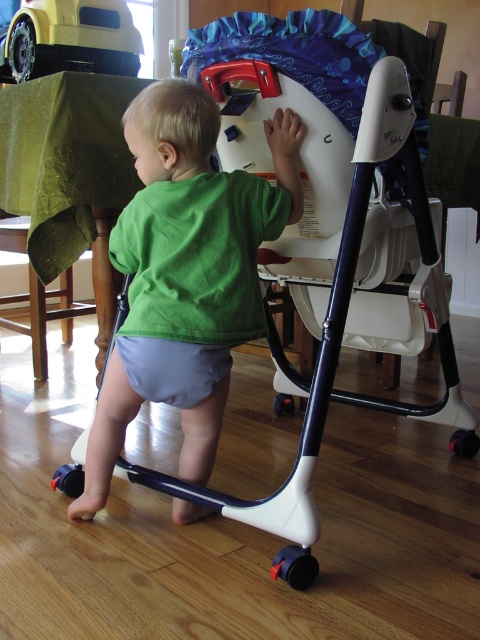
Question: Is green fabric shirt at center thinner than yellow matte toy car at upper left?

Choices:
 (A) yes
 (B) no

Answer: (B)

Question: Observing the image, what is the correct spatial positioning of green fabric shirt at center in reference to yellow matte toy car at upper left?

Choices:
 (A) left
 (B) right

Answer: (B)

Question: Among these points, which one is nearest to the camera?

Choices:
 (A) (112, 65)
 (B) (157, 188)

Answer: (B)

Question: Can you confirm if green fabric shirt at center is positioned above yellow matte toy car at upper left?

Choices:
 (A) yes
 (B) no

Answer: (B)

Question: Which point is closer to the camera taking this photo?

Choices:
 (A) (164, 205)
 (B) (115, 4)

Answer: (A)